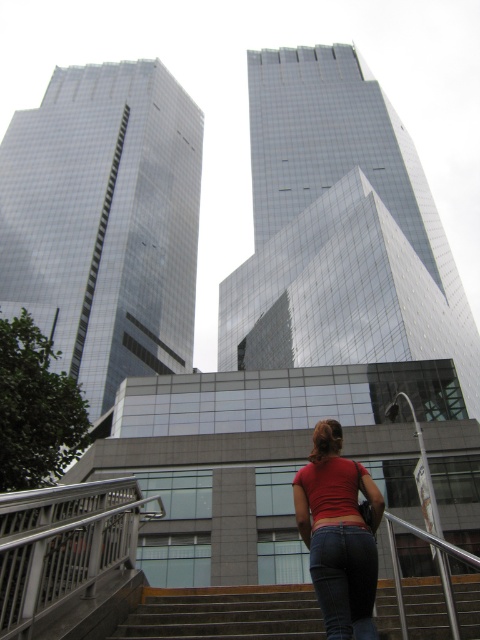
You are a photographer trying to capture the entire scene of the reflective glass skyscraper at center and the red matte shirt at center in one shot. Based on their sizes in the image, which object should you focus on to ensure both are visible without cropping?

The reflective glass skyscraper at center has a larger size compared to the red matte shirt at center, so you should focus on the larger reflective glass skyscraper at center to ensure both are visible without cropping.

You are a photographer trying to capture a photo of the red matte shirt at center and denim at center in the scene. The camera you are using has a minimum focus distance of 3 inches. Can you focus on both objects simultaneously without moving the camera?

The red matte shirt at center and denim at center are 3.03 inches apart, so yes, the camera can focus on both objects simultaneously since the distance between them is just over the minimum focus distance of 3 inches.

You are standing in the urban area and want to take a photo of the reflective glass skyscraper at center and the red matte shirt at center. Which object should you focus on first to ensure both are in the same frame?

You should focus on the red matte shirt at center first because it is closer to you than the reflective glass skyscraper at center, allowing both to be captured in the same frame.